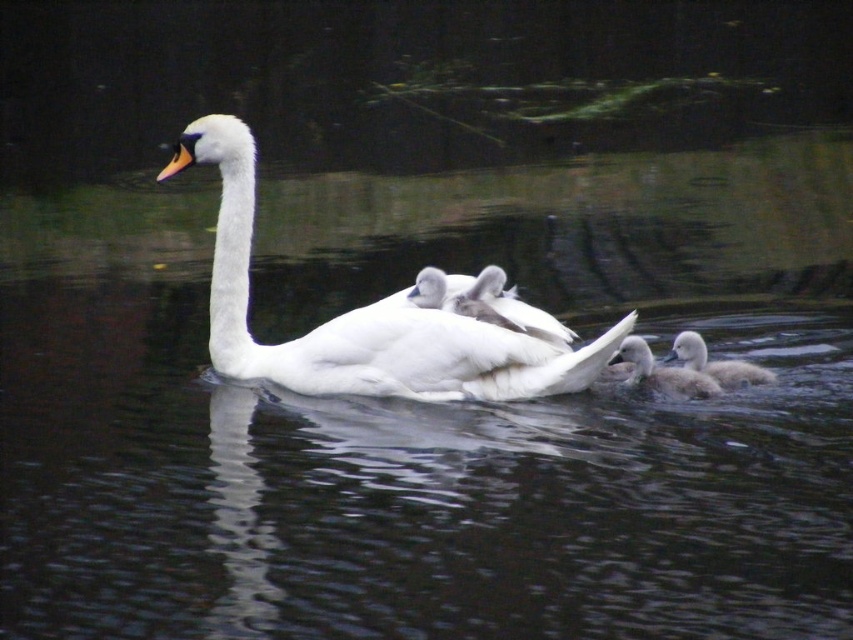
You are a photographer trying to capture the swan family. You have a camera with a 1.2 meter wide lens. The white feathered swan at center and the white fluffy duckling at lower right are in your frame. Can you fit both into your camera view without moving the camera?

The white feathered swan at center might be wider than white fluffy duckling at lower right, so the total width of both would likely exceed the 1.2 meter lens width. Therefore, it might not be possible to fit both into the camera view without moving the camera.

You are a birdwatcher observing the scene. You notice the white feathered swan at center and the white fluffy duckling at lower right. Which of these two birds is taller?

The white feathered swan at center is taller than the white fluffy duckling at lower right.

Based on the scene description, what are the coordinates of the white feathered swan at center?

The white feathered swan at center is located at coordinates point (367,317).